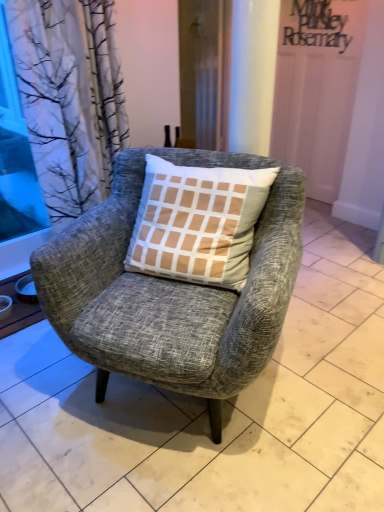
Question: Is transparent glass window screen at left thinner than wooden screen door at center?

Choices:
 (A) no
 (B) yes

Answer: (B)

Question: From the image's perspective, is transparent glass window screen at left over wooden screen door at center?

Choices:
 (A) no
 (B) yes

Answer: (A)

Question: Is the position of transparent glass window screen at left more distant than that of wooden screen door at center?

Choices:
 (A) no
 (B) yes

Answer: (A)

Question: Does transparent glass window screen at left come in front of wooden screen door at center?

Choices:
 (A) no
 (B) yes

Answer: (B)

Question: Can wooden screen door at center be found inside transparent glass window screen at left?

Choices:
 (A) no
 (B) yes

Answer: (A)

Question: Would you consider transparent glass window screen at left to be distant from wooden screen door at center?

Choices:
 (A) no
 (B) yes

Answer: (B)

Question: Does textured gray armchair at center have a lesser height compared to transparent glass window screen at left?

Choices:
 (A) yes
 (B) no

Answer: (A)

Question: Would you say textured gray armchair at center is outside transparent glass window screen at left?

Choices:
 (A) no
 (B) yes

Answer: (B)

Question: Is transparent glass window screen at left inside textured gray armchair at center?

Choices:
 (A) no
 (B) yes

Answer: (A)

Question: From a real-world perspective, is textured gray armchair at center on top of transparent glass window screen at left?

Choices:
 (A) no
 (B) yes

Answer: (A)

Question: From the image's perspective, is textured gray armchair at center on transparent glass window screen at left?

Choices:
 (A) yes
 (B) no

Answer: (B)

Question: Is textured gray armchair at center turned away from transparent glass window screen at left?

Choices:
 (A) no
 (B) yes

Answer: (A)

Question: Is textured gray armchair at center positioned behind wooden screen door at center?

Choices:
 (A) no
 (B) yes

Answer: (A)